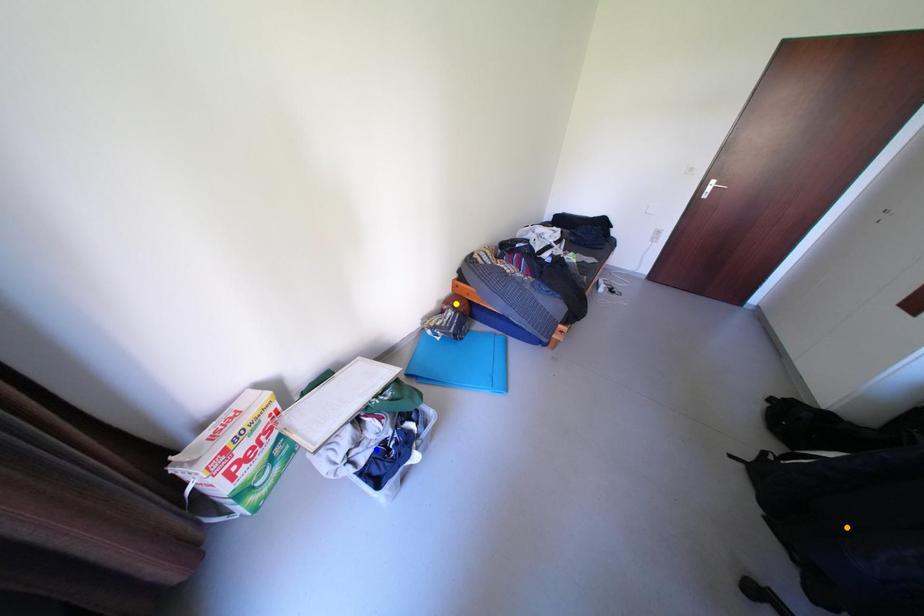
Order these from nearest to farthest:
1. blue point
2. yellow point
3. orange point

orange point, blue point, yellow point